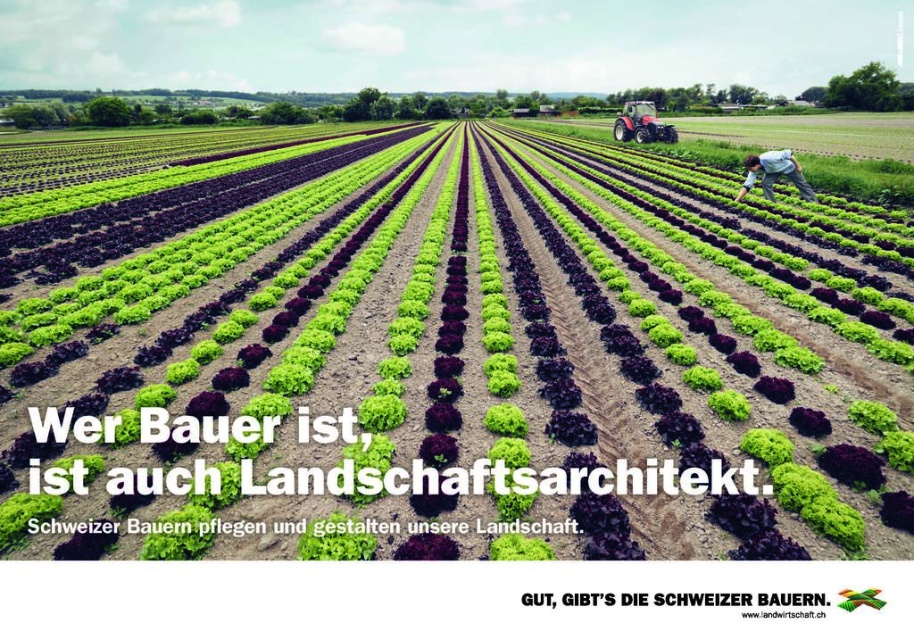
Question: Can you confirm if green leafy vegetables at center is smaller than light blue denim jeans at lower right?

Choices:
 (A) yes
 (B) no

Answer: (B)

Question: Which point is closer to the camera?

Choices:
 (A) green leafy vegetables at center
 (B) light blue denim jeans at lower right
 (C) green leafy at center

Answer: (C)

Question: Which point is farther to the camera?

Choices:
 (A) (772, 196)
 (B) (407, 365)
 (C) (643, 109)
 (D) (319, 524)

Answer: (C)

Question: Which object appears closest to the camera in this image?

Choices:
 (A) light blue denim jeans at lower right
 (B) green leafy vegetables at center
 (C) metallic silver tractor at upper center

Answer: (B)

Question: Does green leafy at center have a smaller size compared to metallic silver tractor at upper center?

Choices:
 (A) no
 (B) yes

Answer: (B)

Question: Does green leafy vegetables at center come behind metallic silver tractor at upper center?

Choices:
 (A) no
 (B) yes

Answer: (A)